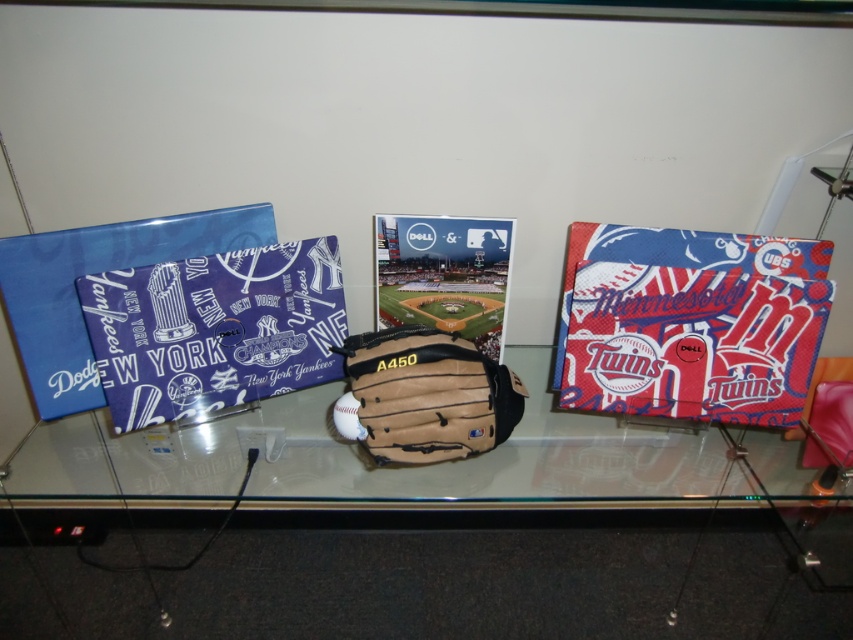
You are a photographer standing in front of the display case. You want to take a photo of the transparent glass table at center without any reflections. Since the table is 34.40 inches away from you, what is the minimum distance you need to move backward to avoid reflections from the items behind you?

The transparent glass table at center is 34.40 inches away from the camera. To avoid reflections, you need to move back at least 34.40 inches so the camera is positioned behind the reflection point.

You are a museum visitor standing in front of the display case. You notice the transparent glass table at center and the brown leather baseball glove at center. Which object is taller?

The transparent glass table at center is taller than the brown leather baseball glove at center according to the description.